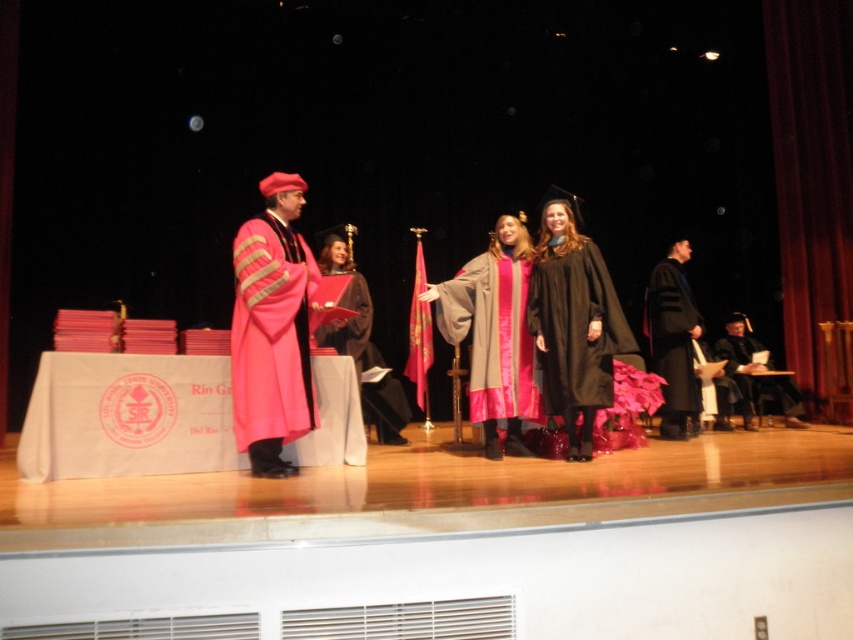
Question: Considering the relative positions of black matte gown at center and matte gray gown with pink accents at center in the image provided, where is black matte gown at center located with respect to matte gray gown with pink accents at center?

Choices:
 (A) left
 (B) right

Answer: (B)

Question: Which object is closer to the camera taking this photo?

Choices:
 (A) black matte graduation gown at right
 (B) black matte gown at center
 (C) matte pink gown at center

Answer: (B)

Question: Where is matte pink fabric at left located in relation to black matte graduation gown at right in the image?

Choices:
 (A) below
 (B) above

Answer: (B)

Question: Is black matte gown at center above matte gray gown with pink accents at center?

Choices:
 (A) yes
 (B) no

Answer: (A)

Question: Which point is closer to the camera?

Choices:
 (A) matte pink fabric at left
 (B) black matte gown at center
 (C) black matte graduation gown at right

Answer: (A)

Question: Which object is positioned farthest from the matte black robe at lower right?

Choices:
 (A) matte pink gown at center
 (B) black matte graduation gown at right
 (C) matte gray gown with pink accents at center

Answer: (A)